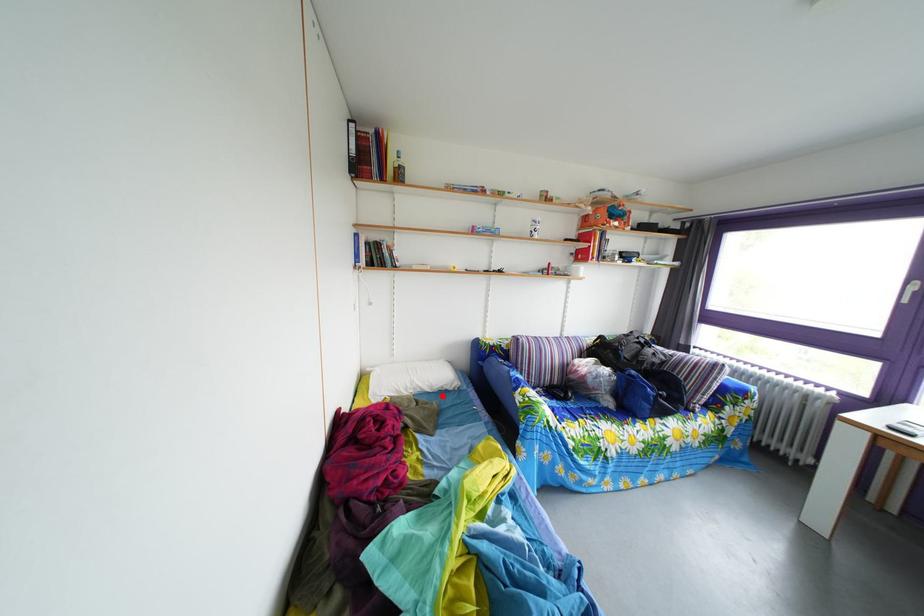
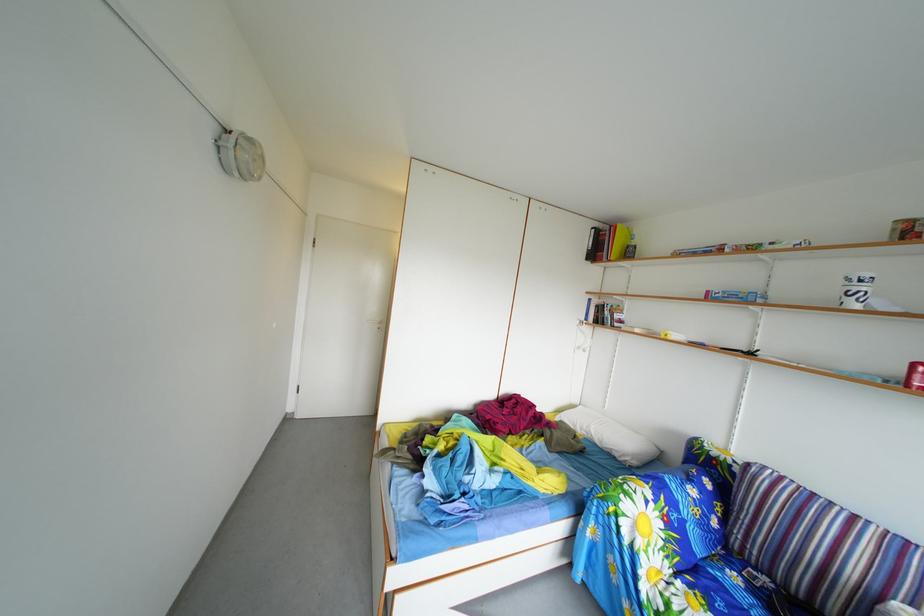
Locate, in the second image, the point that corresponds to the highlighted location in the first image.

(612, 451)